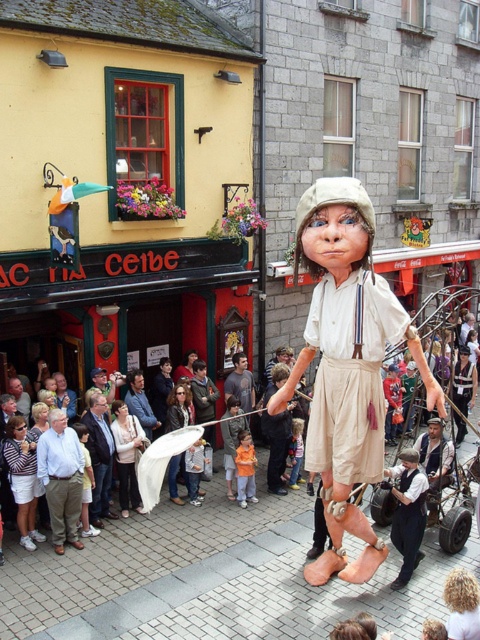
You are a street performer preparing to place a small prop between the matte beige fabric doll at center and the white cotton shirt at center. The prop requires at least 8 feet of space to be placed safely. Can you fit it between them?

The distance between the matte beige fabric doll at center and the white cotton shirt at center is 7.75 feet, which is less than the required 8 feet. Therefore, the prop cannot be safely placed between them.